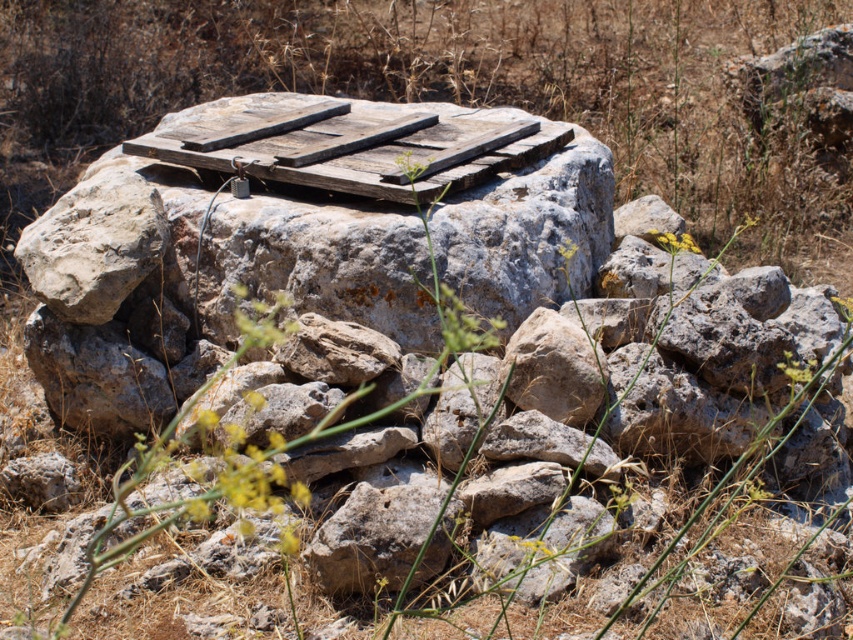
Between weathered wood at center and weathered wood pallet at center, which one appears on the right side from the viewer's perspective?

weathered wood at center is more to the right.

Does weathered wood at center have a greater width compared to weathered wood pallet at center?

Yes, weathered wood at center is wider than weathered wood pallet at center.

Is point (227, 138) farther from camera compared to point (178, 154)?

That is True.

Find the location of a particular element. The width and height of the screenshot is (853, 640). weathered wood at center is located at coordinates (300, 237).